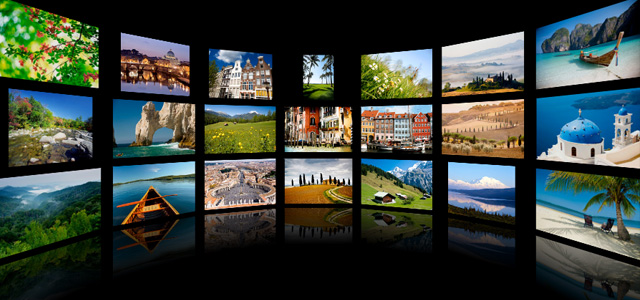
I want to click on top row of tv screens, so click(52, 53), click(154, 66), click(242, 77), click(317, 77), click(399, 74), click(477, 74), click(573, 62).